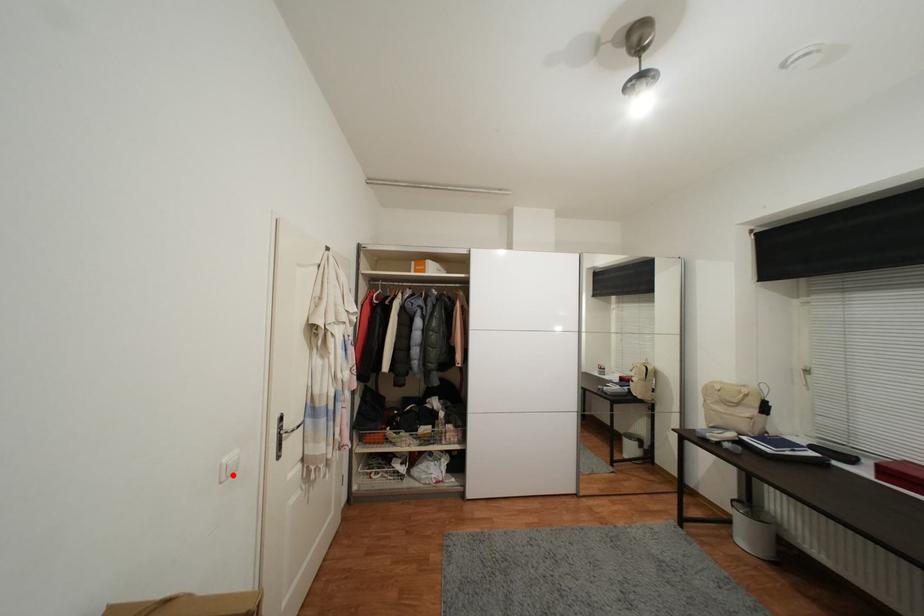
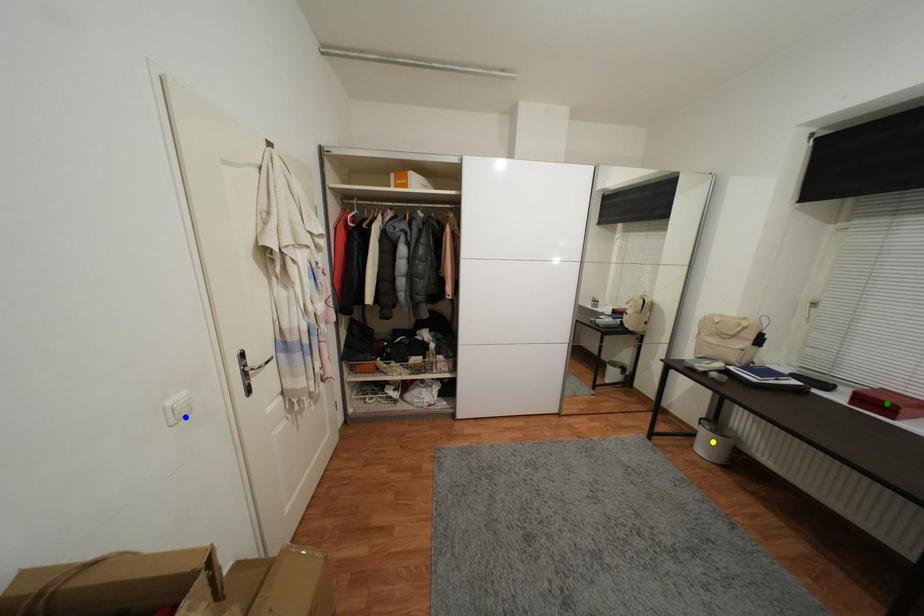
Question: I am providing you with two images of the same scene from different viewpoints. A red point is marked on the first image. You are given multiple points on the second image. Can you choose the point in image 2 that corresponds to the point in image 1?

Choices:
 (A) green point
 (B) yellow point
 (C) blue point

Answer: (C)